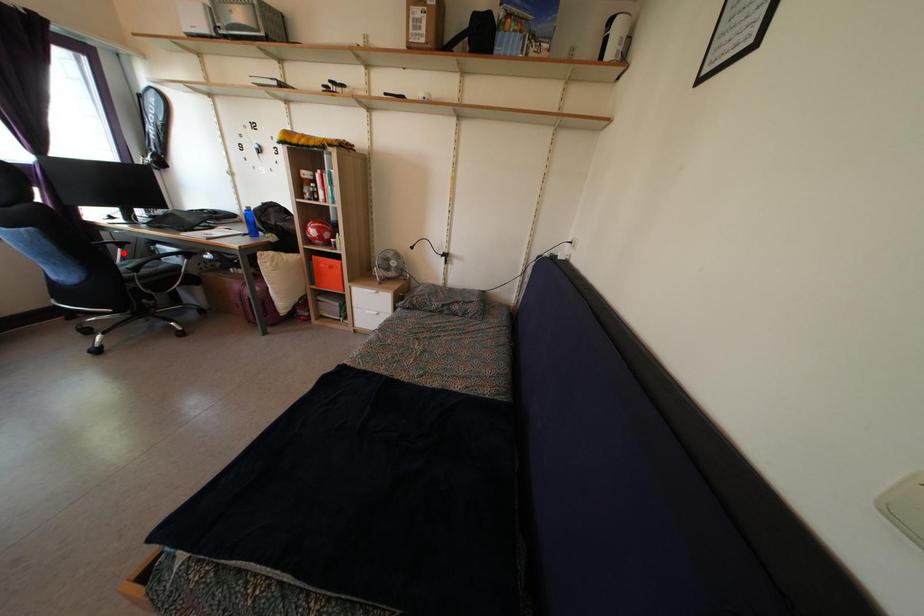
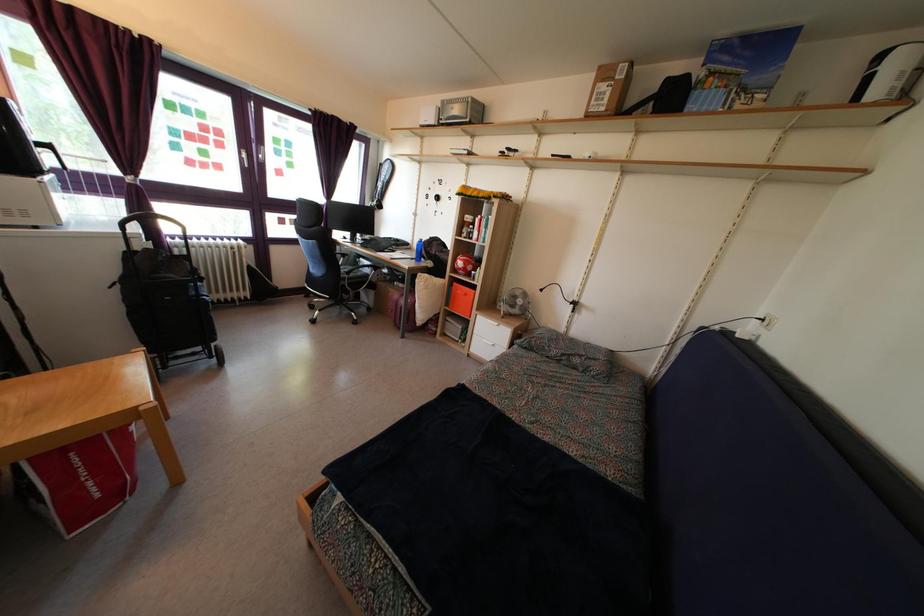
Find the pixel in the second image that matches the highlighted location in the first image.

(346, 264)